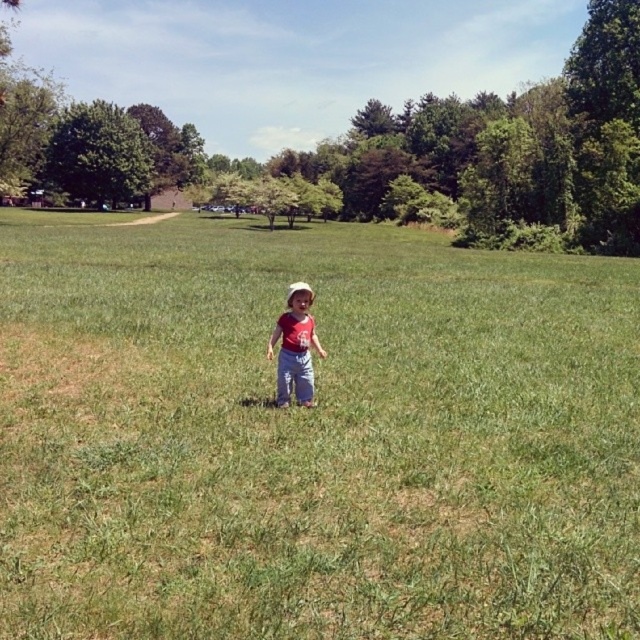
Question: Is green grass at center closer to camera compared to matte red shirt at center?

Choices:
 (A) no
 (B) yes

Answer: (B)

Question: Is green grass at center thinner than matte red shirt at center?

Choices:
 (A) yes
 (B) no

Answer: (B)

Question: Is green grass at center to the right of matte red shirt at center from the viewer's perspective?

Choices:
 (A) yes
 (B) no

Answer: (A)

Question: Among these objects, which one is farthest from the camera?

Choices:
 (A) green grass at center
 (B) matte red shirt at center

Answer: (B)

Question: Which point appears closest to the camera in this image?

Choices:
 (A) (321, 355)
 (B) (141, 230)

Answer: (A)